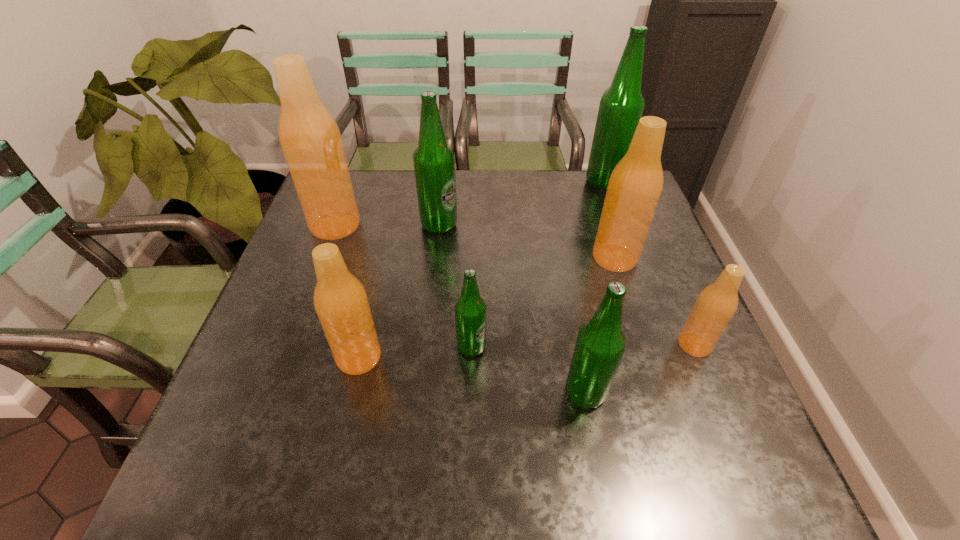
The width and height of the screenshot is (960, 540). I want to click on vacant region located on the left of the second farthest tan beer bottle, so click(x=550, y=258).

This screenshot has width=960, height=540. Identify the location of vacant area situated on the front of the second object from left to right. (328, 490).

Locate an element on the screen. The image size is (960, 540). vacant region located on the label of the nearest green beer bottle is located at coordinates (463, 393).

Where is `vacant area located 0.050m on the label of the nearest green beer bottle`? vacant area located 0.050m on the label of the nearest green beer bottle is located at coordinates (539, 393).

Locate an element on the screen. Image resolution: width=960 pixels, height=540 pixels. vacant point located on the label of the nearest green beer bottle is located at coordinates (483, 393).

The height and width of the screenshot is (540, 960). In order to click on free spot located 0.220m on the label of the fifth object from right to left in this screenshot , I will do `click(588, 347)`.

The width and height of the screenshot is (960, 540). In order to click on vacant space located 0.200m on the left of the smallest tan beer bottle in this screenshot , I will do `click(586, 345)`.

The width and height of the screenshot is (960, 540). In order to click on object positioned at the left edge in this screenshot , I will do `click(309, 136)`.

This screenshot has width=960, height=540. What are the coordinates of `object situated at the far left corner` in the screenshot? It's located at (309, 136).

Image resolution: width=960 pixels, height=540 pixels. I want to click on object that is positioned at the far right corner, so click(x=621, y=106).